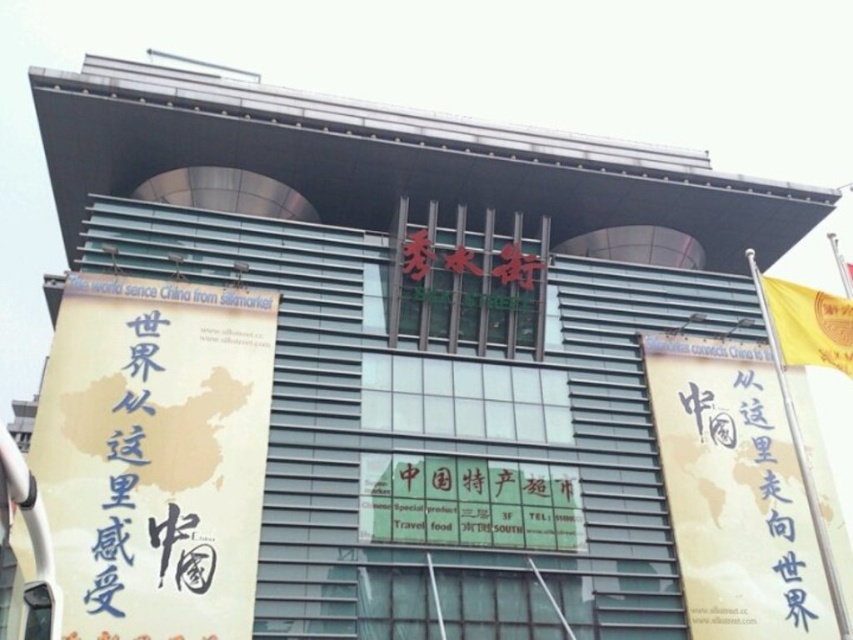
What is the position of the yellow paper banner at right relative to the other banners on the building facade?

The yellow paper banner at right is located at point [734,492], which places it on the right side of the building facade.